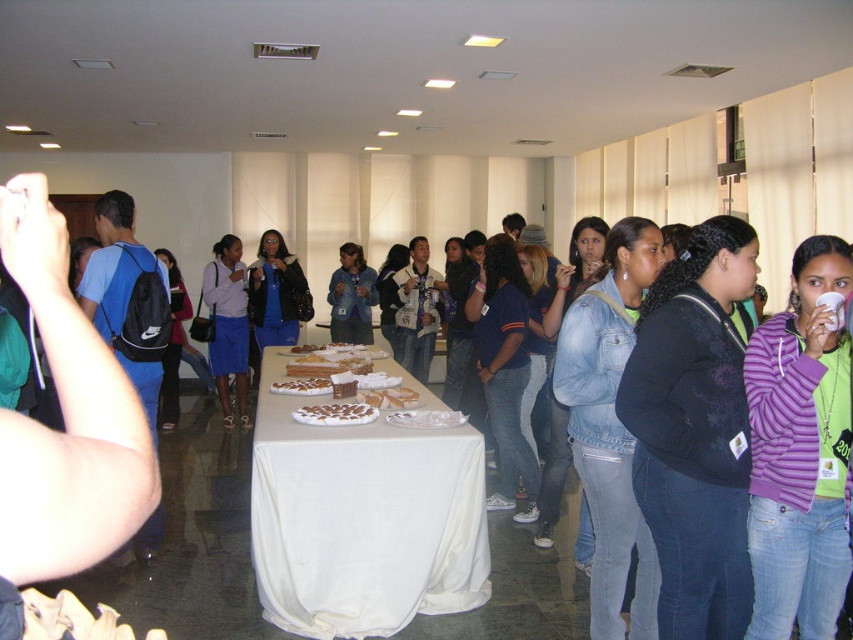
Who is positioned more to the left, white cloth table at center or white glossy plate at center?

white cloth table at center is more to the left.

In the scene shown: Does white cloth table at center have a lesser height compared to white glossy plate at center?

Incorrect, white cloth table at center's height does not fall short of white glossy plate at center's.

Is point (264, 410) more distant than point (415, 417)?

Yes, point (264, 410) is farther from viewer.

Locate an element on the screen. This screenshot has width=853, height=640. white cloth table at center is located at coordinates (363, 518).

Is chocolate-coated nuts at center thinner than golden brown pastry at center?

No.

In the scene shown: Can you confirm if chocolate-coated nuts at center is positioned above golden brown pastry at center?

No, chocolate-coated nuts at center is not above golden brown pastry at center.

Which is in front, point (347, 420) or point (328, 388)?

Point (347, 420) is more forward.

Find the location of a particular element. The height and width of the screenshot is (640, 853). chocolate-coated nuts at center is located at coordinates (335, 413).

Which of these two, white glossy plate at center or golden brown pastry at center, stands taller?

golden brown pastry at center is taller.

Who is lower down, white glossy plate at center or golden brown pastry at center?

white glossy plate at center is lower down.

Which is in front, point (421, 412) or point (286, 392)?

Positioned in front is point (421, 412).

Identify the location of white glossy plate at center. (426, 419).